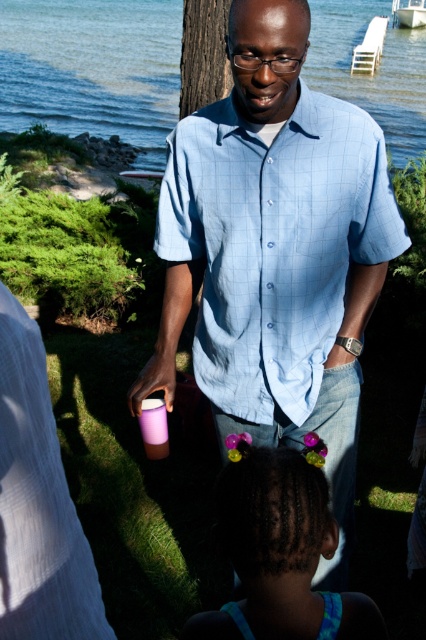
Question: In this image, where is blue water at upper center located relative to purple hairband at lower center?

Choices:
 (A) right
 (B) left

Answer: (B)

Question: Which object appears farthest from the camera in this image?

Choices:
 (A) light blue checkered shirt at center
 (B) purple plastic cup at lower center

Answer: (B)

Question: Which object appears closest to the camera in this image?

Choices:
 (A) blue water at upper center
 (B) purple plastic cup at lower center
 (C) light blue checkered shirt at center
 (D) purple hairband at lower center

Answer: (D)

Question: Is purple hairband at lower center wider than purple plastic cup at lower center?

Choices:
 (A) no
 (B) yes

Answer: (B)

Question: Is light blue checkered shirt at center thinner than purple hairband at lower center?

Choices:
 (A) no
 (B) yes

Answer: (A)

Question: Which of these objects is positioned closest to the light blue checkered shirt at center?

Choices:
 (A) purple hairband at lower center
 (B) purple plastic cup at lower center
 (C) blue water at upper center

Answer: (B)